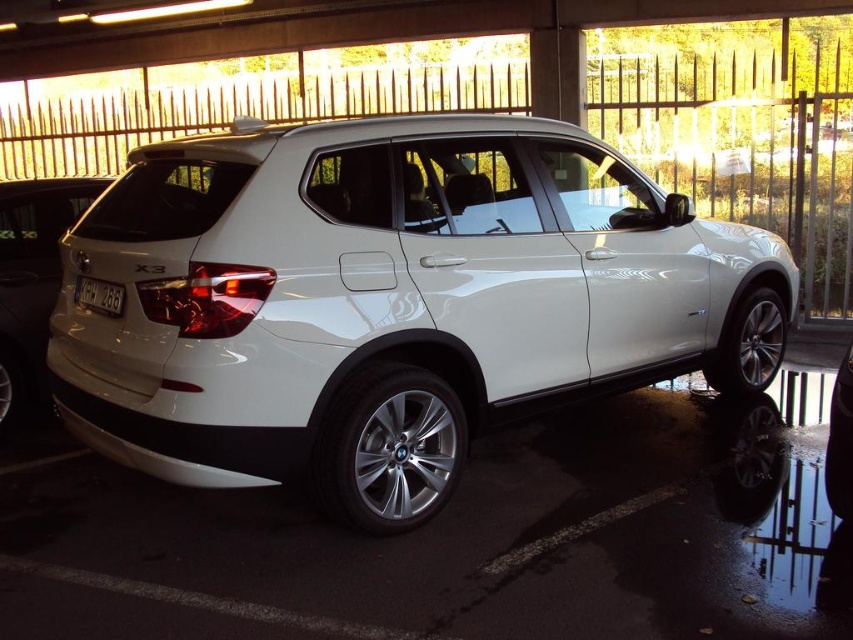
Question: Which object appears closest to the camera in this image?

Choices:
 (A) white glossy suv at center
 (B) white plastic license plate at rear
 (C) white glossy car at center
 (D) white glossy minivan at lower left

Answer: (C)

Question: Which object is farther from the camera taking this photo?

Choices:
 (A) white glossy car at center
 (B) white glossy minivan at lower left

Answer: (B)

Question: Which of the following is the closest to the observer?

Choices:
 (A) white glossy suv at center
 (B) white glossy car at center
 (C) white plastic license plate at rear
 (D) white glossy minivan at lower left

Answer: (B)

Question: Where is white glossy suv at center located in relation to white glossy car at center in the image?

Choices:
 (A) above
 (B) below

Answer: (A)

Question: Is white glossy minivan at lower left in front of white plastic license plate at rear?

Choices:
 (A) no
 (B) yes

Answer: (A)

Question: Where is white glossy minivan at lower left located in relation to white plastic license plate at rear in the image?

Choices:
 (A) left
 (B) right

Answer: (A)